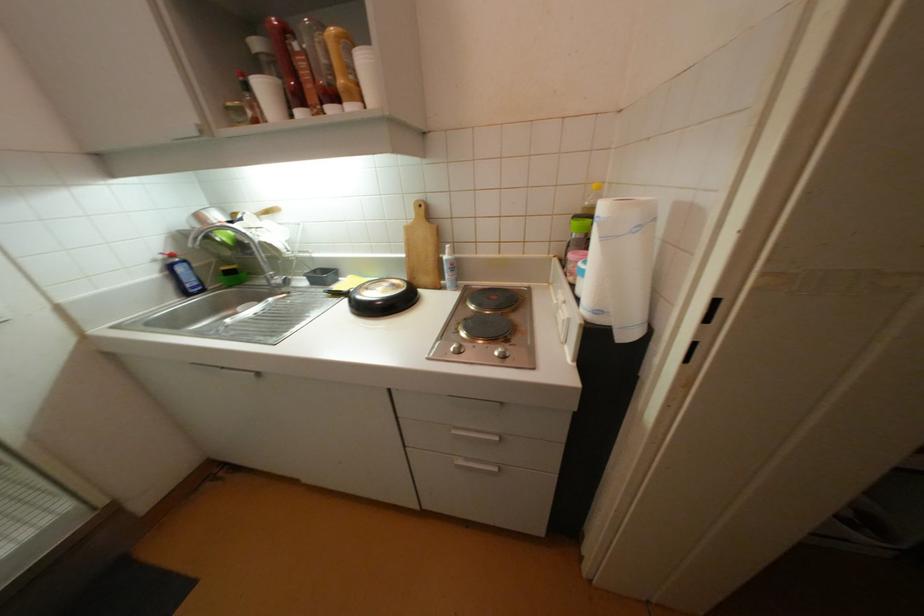
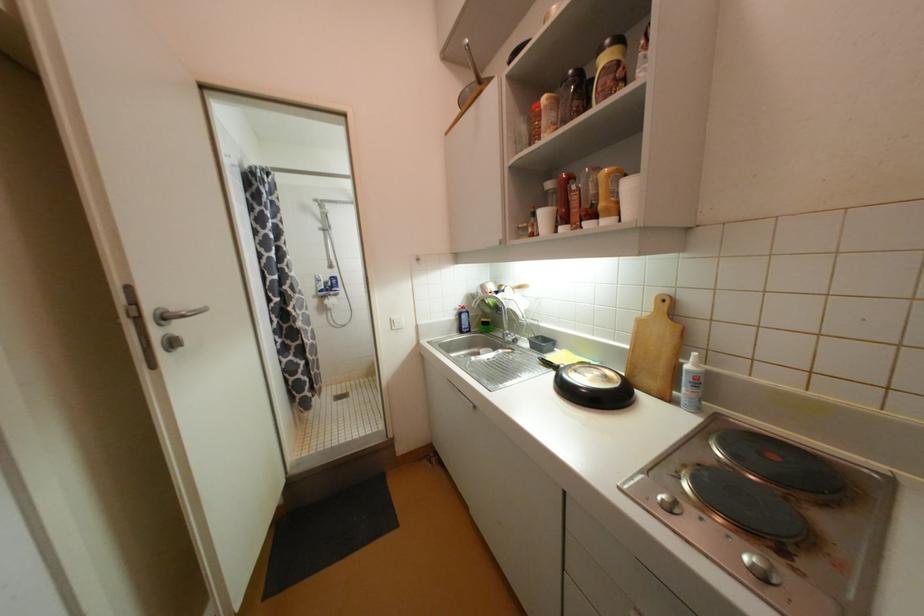
Find the pixel in the second image that matches point (458, 347) in the first image.

(669, 498)